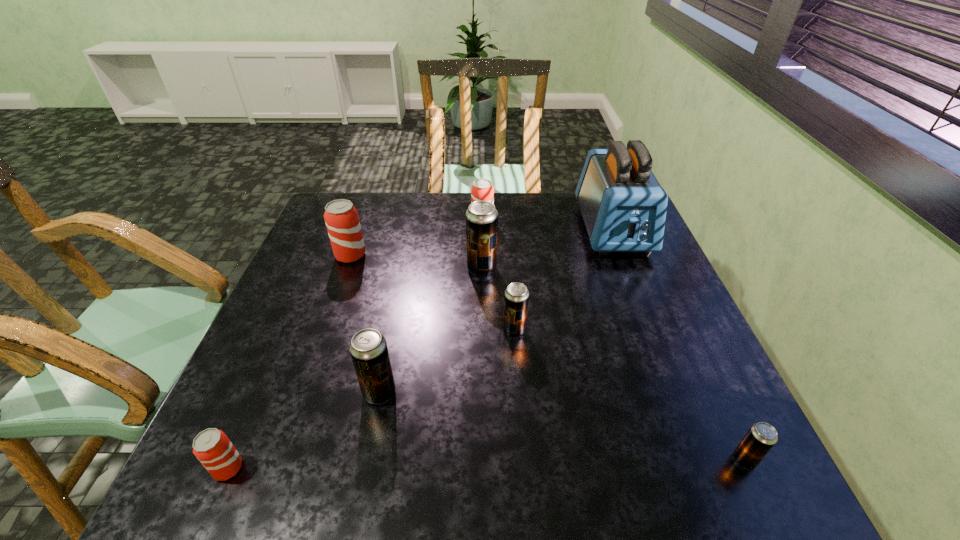
I want to click on the tallest object, so [623, 205].

Identify the location of blue toaster. (623, 205).

Where is `the tallest beer can`? the tallest beer can is located at coordinates (481, 218).

In order to click on the second black beer can from left to right in this screenshot , I will do `click(481, 218)`.

This screenshot has height=540, width=960. What are the coordinates of `the biggest orange beer can` in the screenshot? It's located at (342, 221).

I want to click on the sixth beer can from right to left, so click(342, 221).

Image resolution: width=960 pixels, height=540 pixels. I want to click on the fifth farthest beer can, so click(368, 348).

I want to click on the sixth object from right to left, so click(x=368, y=348).

This screenshot has height=540, width=960. Identify the location of the farthest orange beer can. (482, 189).

Where is `the farthest beer can`? the farthest beer can is located at coordinates click(x=482, y=189).